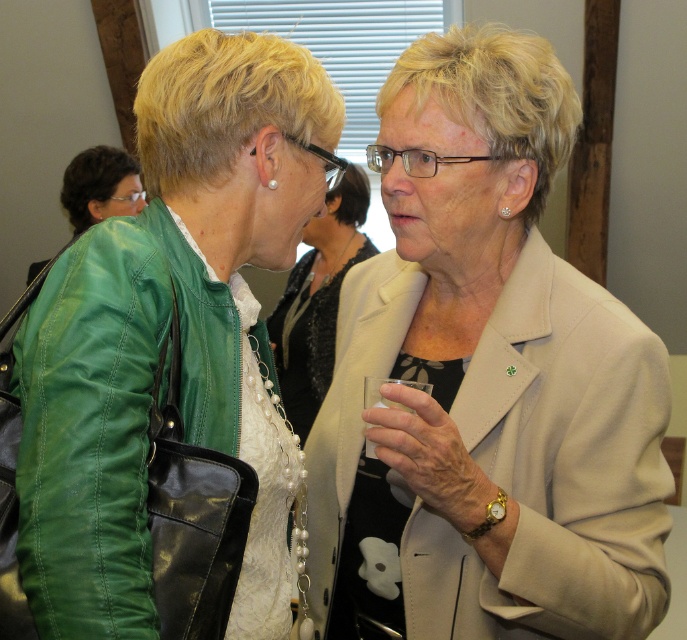
Image resolution: width=687 pixels, height=640 pixels. I want to click on green leather jacket at left, so click(x=166, y=333).

Is green leather jacket at left bigger than matte beige blazer at center?

No.

The width and height of the screenshot is (687, 640). Describe the element at coordinates (166, 333) in the screenshot. I see `green leather jacket at left` at that location.

You are a GUI agent. You are given a task and a screenshot of the screen. Output one action in this format:
    pyautogui.click(x=<x>, y=<y>)
    Task: Click on the green leather jacket at left
    The image size is (687, 640).
    Given the screenshot: What is the action you would take?
    pyautogui.click(x=166, y=333)

Which is above, beige satin blazer at center or matte beige blazer at center?

matte beige blazer at center is above.

Looking at this image, between beige satin blazer at center and matte beige blazer at center, which one has more height?

Standing taller between the two is beige satin blazer at center.

Does point (368, 541) come behind point (339, 218)?

No.

The width and height of the screenshot is (687, 640). Identify the location of beige satin blazer at center. (484, 381).

Between beige satin blazer at center and green leather jacket at left, which one appears on the left side from the viewer's perspective?

From the viewer's perspective, green leather jacket at left appears more on the left side.

What do you see at coordinates (484, 381) in the screenshot? I see `beige satin blazer at center` at bounding box center [484, 381].

The height and width of the screenshot is (640, 687). Identify the location of beige satin blazer at center. (484, 381).